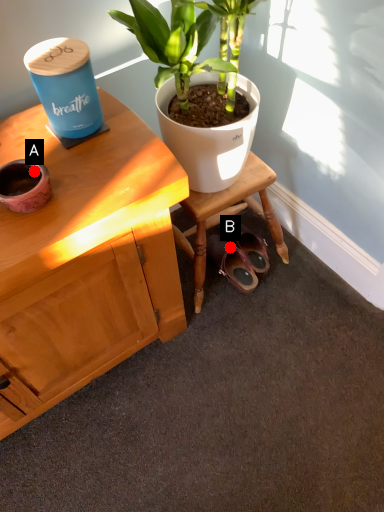
Question: Two points are circled on the image, labeled by A and B beside each circle. Which of the following is the farthest from the observer?

Choices:
 (A) A is further
 (B) B is further

Answer: (B)